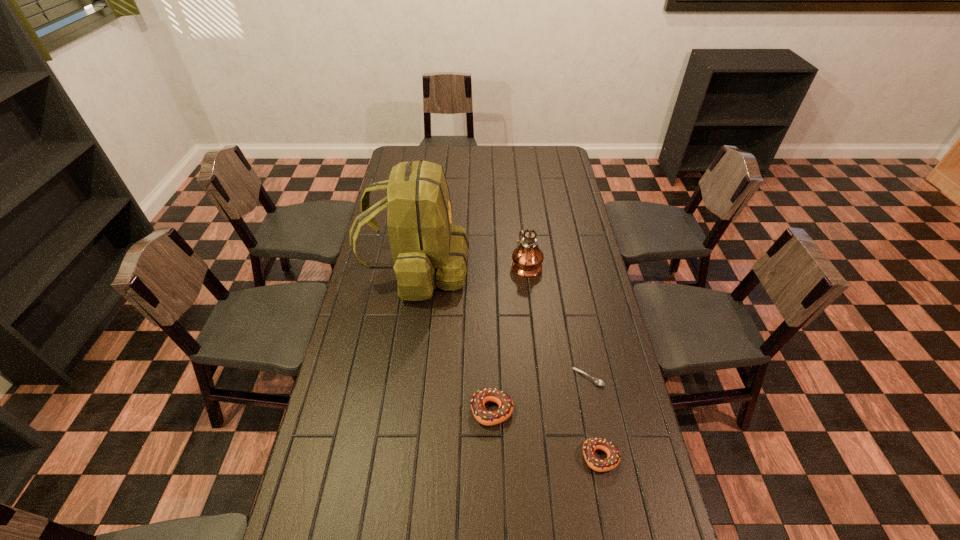
This screenshot has height=540, width=960. I want to click on the left doughnut, so click(481, 396).

Where is `the fourth object from right to left`? Image resolution: width=960 pixels, height=540 pixels. the fourth object from right to left is located at coordinates (481, 396).

Identify the location of the nearer doughnut. The image size is (960, 540). (590, 445).

Locate an element on the screen. The image size is (960, 540). the right doughnut is located at coordinates (590, 445).

You are a GUI agent. You are given a task and a screenshot of the screen. Output one action in this format:
    pyautogui.click(x=<x>, y=<y>)
    Task: Click on the oil lamp
    The height and width of the screenshot is (540, 960).
    Given the screenshot: What is the action you would take?
    pyautogui.click(x=527, y=257)

This screenshot has height=540, width=960. Find the location of `the third object from right to left`. the third object from right to left is located at coordinates (527, 257).

What are the coordinates of `the tallest object` in the screenshot? It's located at (428, 250).

The width and height of the screenshot is (960, 540). Identify the location of the leftmost object. (428, 250).

At what (x,y) coordinates should I click in order to perform the action: click on the third nearest object. Please return your answer as a coordinate pair (x, y). Image resolution: width=960 pixels, height=540 pixels. Looking at the image, I should click on (597, 381).

The width and height of the screenshot is (960, 540). I want to click on soupspoon, so click(x=597, y=381).